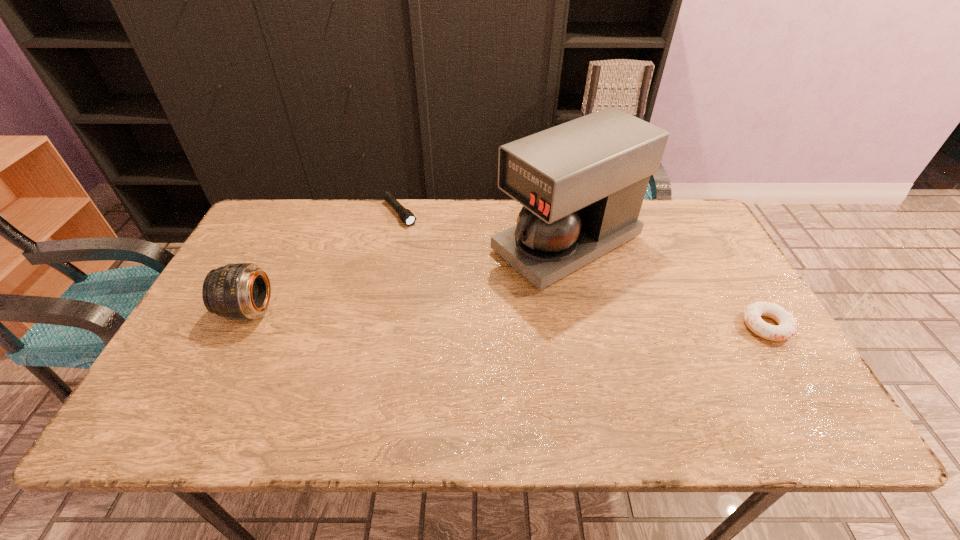
Locate an element on the screen. Image resolution: width=960 pixels, height=540 pixels. free region located 0.350m on the carafe side of the tallest object is located at coordinates (398, 328).

At what (x,y) coordinates should I click in order to perform the action: click on vacant region located at the lens end of the third object from right to left. Please return your answer as a coordinate pair (x, y). Image resolution: width=960 pixels, height=540 pixels. Looking at the image, I should click on (476, 299).

Locate an element on the screen. The image size is (960, 540). vacant area situated at the lens end of the third object from right to left is located at coordinates [x=468, y=290].

This screenshot has height=540, width=960. What are the coordinates of `free space located 0.170m at the lens end of the third object from right to left` in the screenshot? It's located at (435, 254).

Where is `coffee maker at the far edge`? Image resolution: width=960 pixels, height=540 pixels. coffee maker at the far edge is located at coordinates (582, 183).

This screenshot has width=960, height=540. Find the location of `flashlight that is positioned at the far edge`. flashlight that is positioned at the far edge is located at coordinates (405, 215).

Where is `object that is at the left edge`? The width and height of the screenshot is (960, 540). object that is at the left edge is located at coordinates (242, 291).

This screenshot has height=540, width=960. Find the location of `object that is positioned at the right edge`. object that is positioned at the right edge is located at coordinates (787, 326).

The image size is (960, 540). What are the coordinates of `blank area at the far edge` in the screenshot? It's located at pos(420,226).

Locate an element on the screen. The width and height of the screenshot is (960, 540). blank space at the near edge of the desktop is located at coordinates (309, 382).